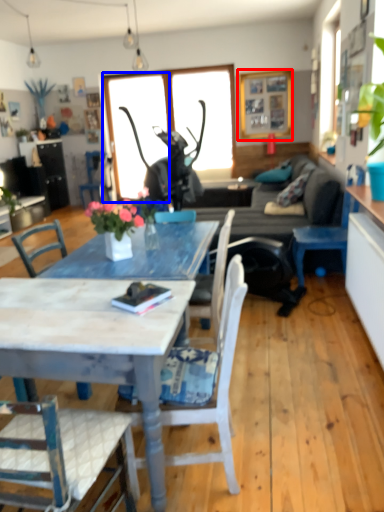
Question: Among these objects, which one is nearest to the camera, picture frame (highlighted by a red box) or window screen (highlighted by a blue box)?

Choices:
 (A) picture frame
 (B) window screen

Answer: (A)